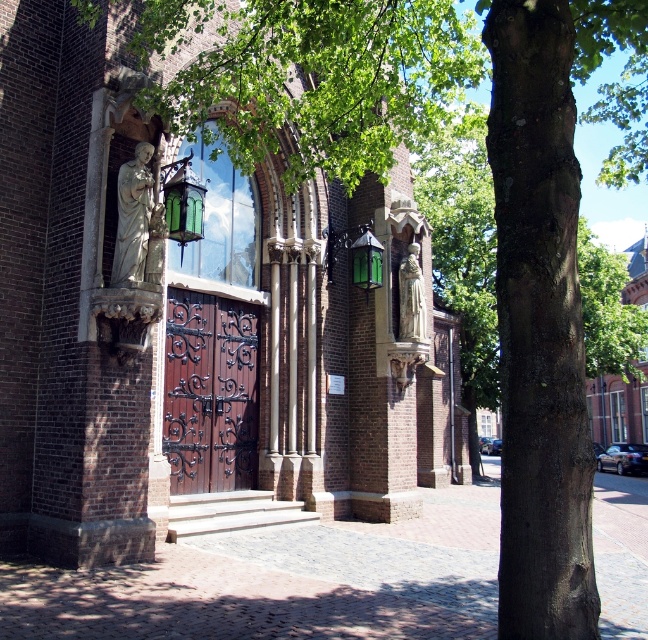
Question: From the image, what is the correct spatial relationship of dark wood wrought iron door at center in relation to smooth wooden door at center?

Choices:
 (A) below
 (B) above

Answer: (B)

Question: Which of these objects is positioned closest to the brick pavement at center?

Choices:
 (A) dark wood wrought iron door at center
 (B) brick church at center
 (C) smooth wooden door at center
 (D) white marble statue at left

Answer: (B)

Question: Which of the following is the farthest from the observer?

Choices:
 (A) (122, 195)
 (B) (402, 268)
 (C) (642, 394)

Answer: (C)

Question: Among these points, which one is nearest to the camera?

Choices:
 (A) [x=253, y=410]
 (B) [x=209, y=612]
 (C) [x=411, y=250]

Answer: (B)

Question: Is brick pavement at center below white marble statue at left?

Choices:
 (A) no
 (B) yes

Answer: (B)

Question: Is brick church at center positioned behind brick pavement at center?

Choices:
 (A) yes
 (B) no

Answer: (A)